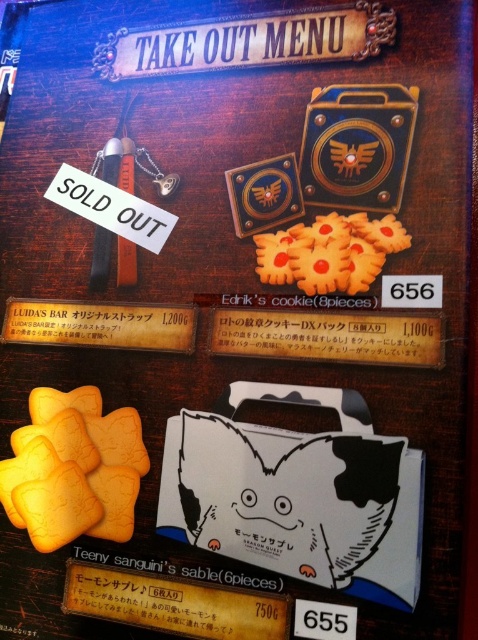
You are designing a display for a fantasy themed bakery and need to arrange the matte gold cookie at center and the wooden sign at center on a shelf. Given that the cookie is taller than the sign, which item should you place behind the other to ensure both are visible?

Since the matte gold cookie at center is taller than the wooden sign at center, you should place the cookie behind the sign so that the shorter wooden sign remains visible in front.

You are a customer at this fantasy themed takeout place. You see the yellow matte biscuit at center and the matte white paper at lower center. Which item is placed higher up on the menu?

The yellow matte biscuit at center is positioned over the matte white paper at lower center, meaning it is placed higher up on the menu.